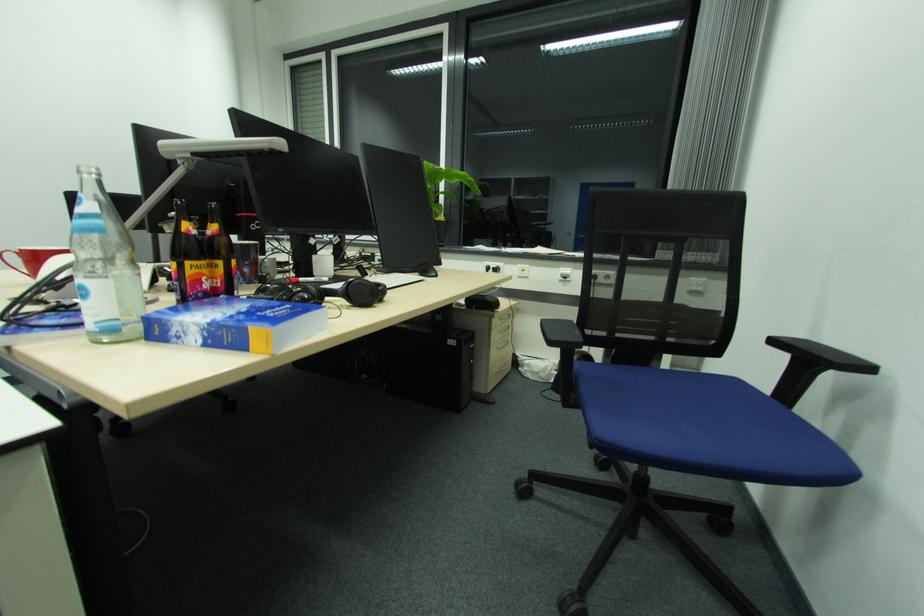
The height and width of the screenshot is (616, 924). Describe the element at coordinates (699, 426) in the screenshot. I see `the blue chair sitting surface` at that location.